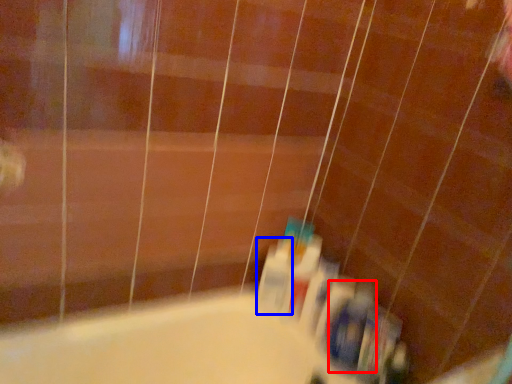
Question: Which object appears closest to the camera in this image, toiletry (highlighted by a red box) or toiletry (highlighted by a blue box)?

Choices:
 (A) toiletry
 (B) toiletry

Answer: (A)